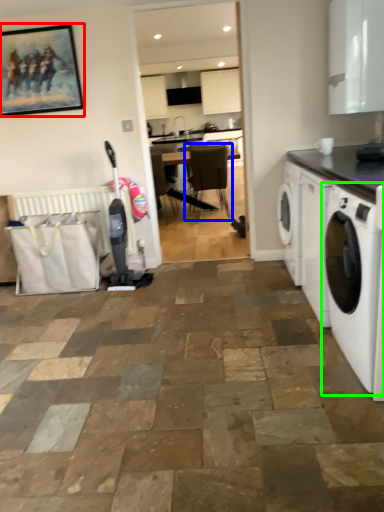
Question: Which object is positioned farthest from picture frame (highlighted by a red box)? Select from chair (highlighted by a blue box) and washing machine (highlighted by a green box).

Choices:
 (A) chair
 (B) washing machine

Answer: (A)